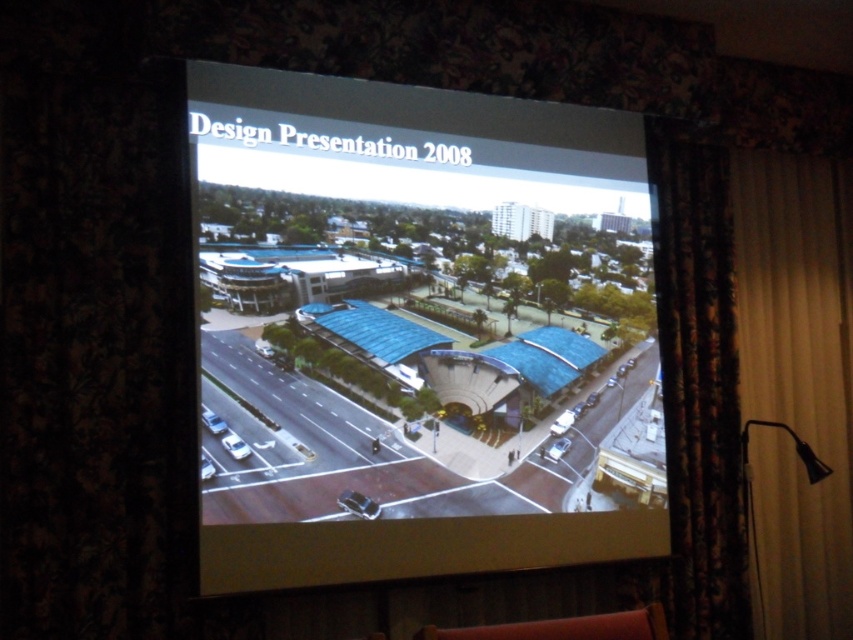
You are an interior designer evaluating the projection screen setup. The dark floral fabric curtain at right and shiny silver car at center are both visible in the projected image. Which object takes up more space in the image?

The dark floral fabric curtain at right is larger in size than the shiny silver car at center, so it takes up more space in the image.

You are an event planner setting up for a presentation. You notice the white fabric curtain at right and the white glossy car at lower left in the projected slide. Which object is positioned higher in the image?

The white fabric curtain at right is located above the white glossy car at lower left, so it is positioned higher in the image.